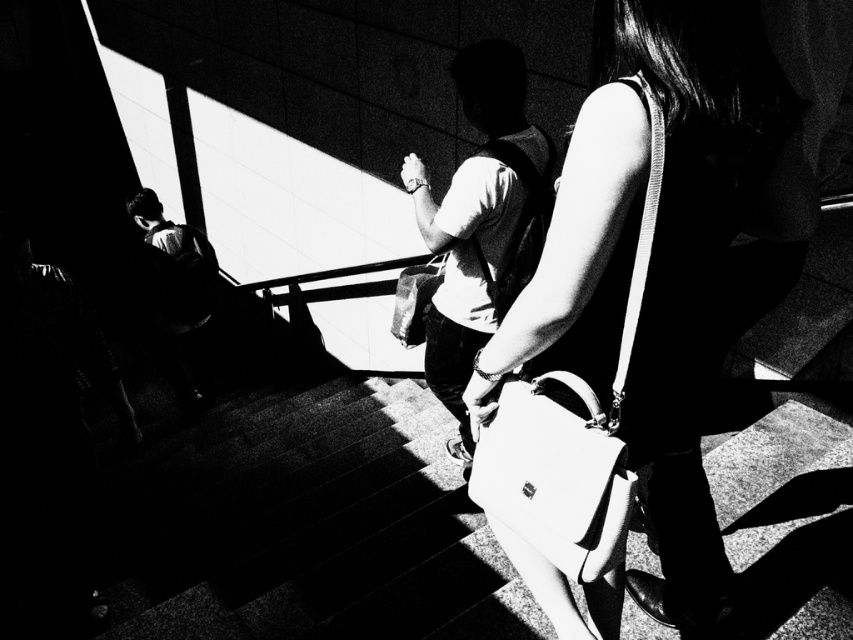
This screenshot has height=640, width=853. I want to click on matte white handbag at center, so click(x=660, y=273).

Is point (560, 285) farther from camera compared to point (515, 504)?

No, (560, 285) is in front of (515, 504).

Identify the location of matte white handbag at center. (660, 273).

Is white leather shoulder bag at center shorter than white leather handbag at center?

Incorrect, white leather shoulder bag at center's height does not fall short of white leather handbag at center's.

Where is `white leather shoulder bag at center`? This screenshot has width=853, height=640. white leather shoulder bag at center is located at coordinates click(570, 435).

This screenshot has height=640, width=853. I want to click on white leather shoulder bag at center, so click(570, 435).

Between point (695, 525) and point (619, 380), which one is positioned in front?

Point (619, 380) is more forward.

Is point (671, 106) closer to camera compared to point (637, 243)?

Yes.

The width and height of the screenshot is (853, 640). Find the location of `matte white handbag at center`. matte white handbag at center is located at coordinates (660, 273).